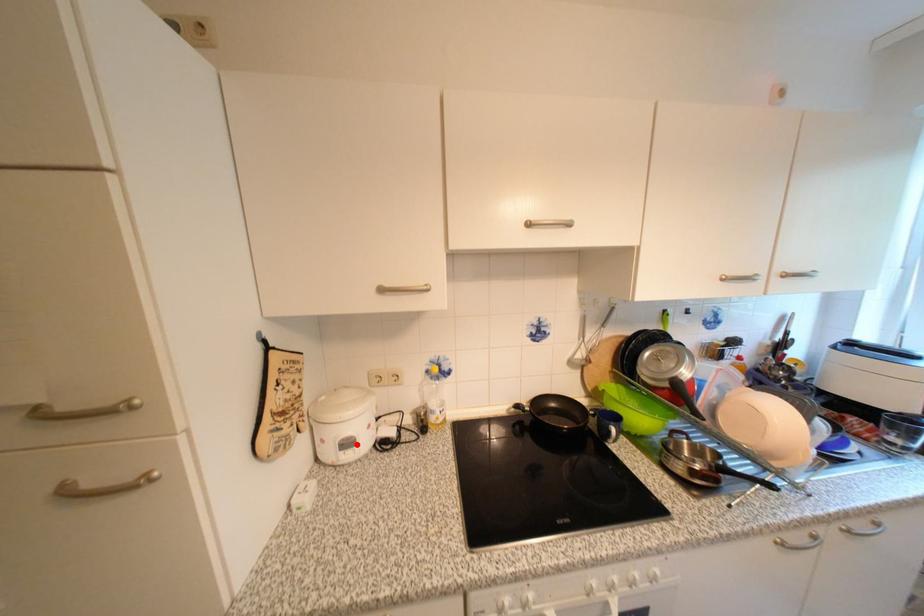
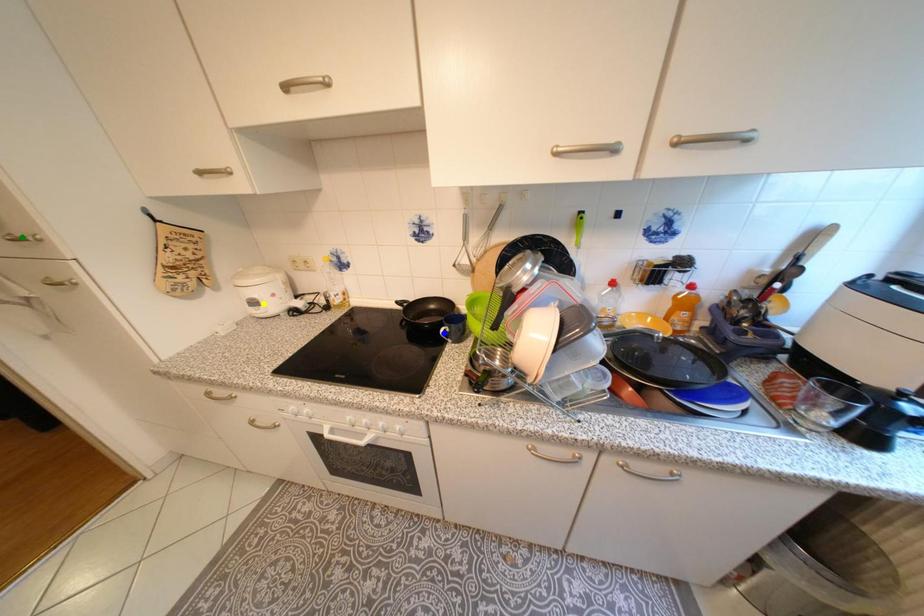
Question: I am providing you with two images of the same scene from different viewpoints. A red point is marked on the first image. You are given multiple points on the second image. Which spot in image 2 lines up with the point in image 1?

Choices:
 (A) yellow point
 (B) blue point
 (C) green point

Answer: (A)